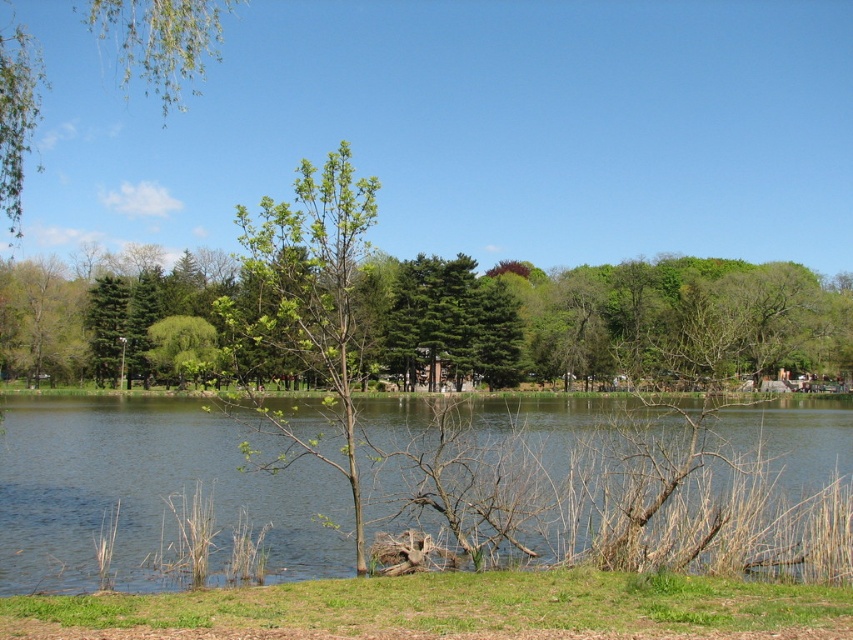
Question: In this image, where is green leafy tree at center located relative to green grass at lower center?

Choices:
 (A) left
 (B) right

Answer: (A)

Question: Considering the real-world distances, which object is farthest from the green leafy tree at upper left?

Choices:
 (A) green leafy tree at center
 (B) green grass at lower center

Answer: (B)

Question: Among these points, which one is farthest from the camera?

Choices:
 (A) (189, 90)
 (B) (254, 611)
 (C) (500, 488)

Answer: (A)

Question: Can you confirm if green leafy tree at center is positioned above green leafy tree at upper left?

Choices:
 (A) yes
 (B) no

Answer: (B)

Question: Which point is farther to the camera?

Choices:
 (A) green grass at lower center
 (B) clear water at center

Answer: (B)

Question: Is green leafy tree at center positioned in front of green leafy tree at upper left?

Choices:
 (A) yes
 (B) no

Answer: (A)